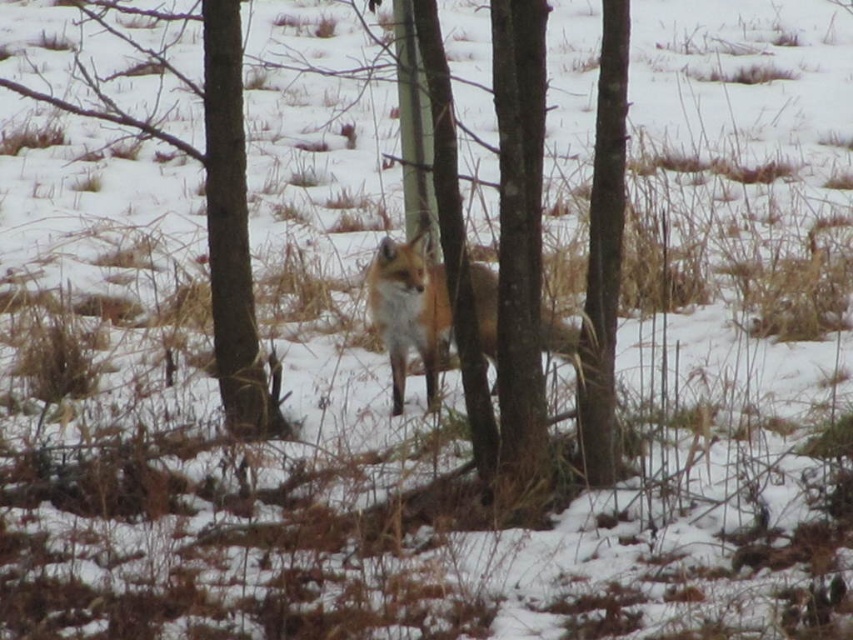
You are a hiker trying to locate a smooth bark tree at center in a snowy forest. According to the coordinates provided, where exactly would you find this tree?

The smooth bark tree at center is located at point (x=519, y=234), so you can find it there.

You are an animal tracker trying to locate the fox in the snowy forest. You notice two trees in the center of the scene. Which tree is narrower between the smooth bark tree at center and the brown bark tree at center?

The smooth bark tree at center is narrower than the brown bark tree at center.